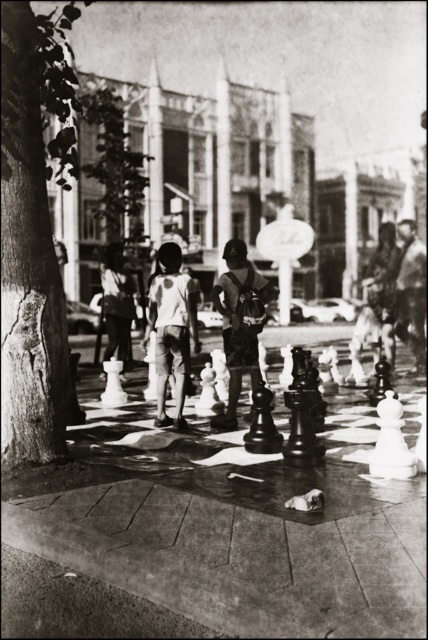
You are a photographer trying to capture a clear shot of both the light gray cotton shorts at center and the dark blue denim shorts at center. Since you want both subjects in focus, which one should you adjust your camera focus to prioritize first?

You should prioritize focusing on the dark blue denim shorts at center first because it is behind the light gray cotton shorts at center, so ensuring the background is sharp will help both be in focus.

You are a photographer standing in the plaza and see the children wearing light gray cotton shorts at center and dark blue denim shorts at center. Which child is positioned to the left when looking at the scene from your perspective?

The light gray cotton shorts at center is to the left of dark blue denim shorts at center, so the child wearing light gray cotton shorts at center is positioned to the left.